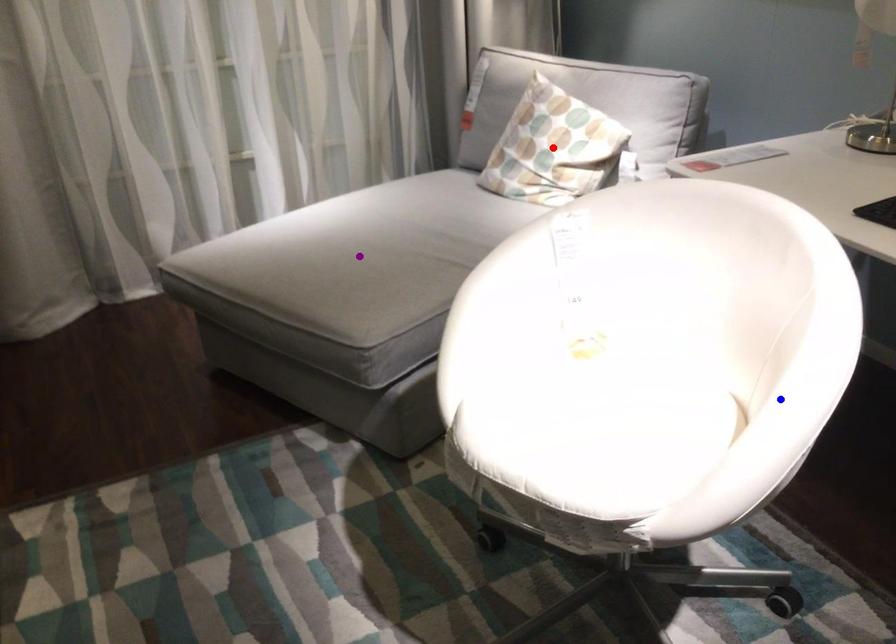
Order these from nearest to farthest:
red point
purple point
blue point

blue point → purple point → red point